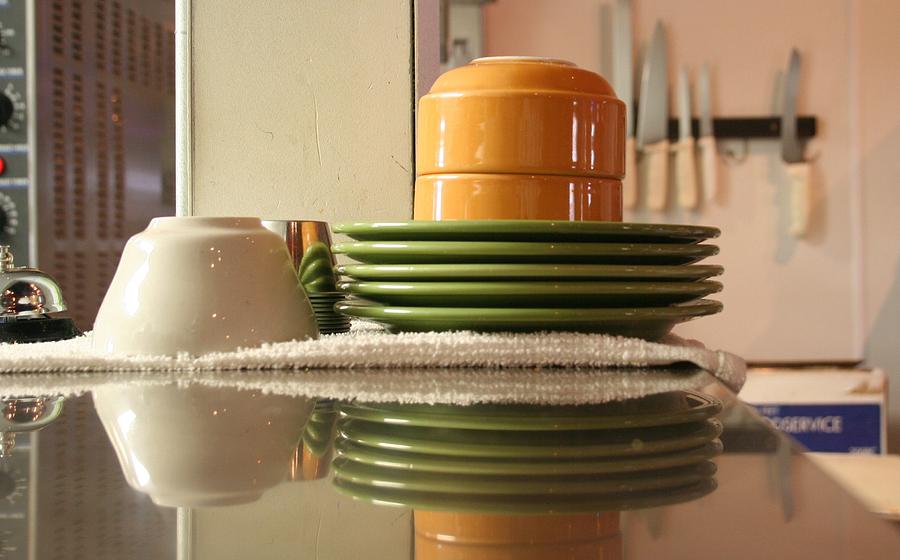
The width and height of the screenshot is (900, 560). I want to click on knives, so click(796, 183), click(713, 148), click(685, 157), click(659, 161), click(619, 72).